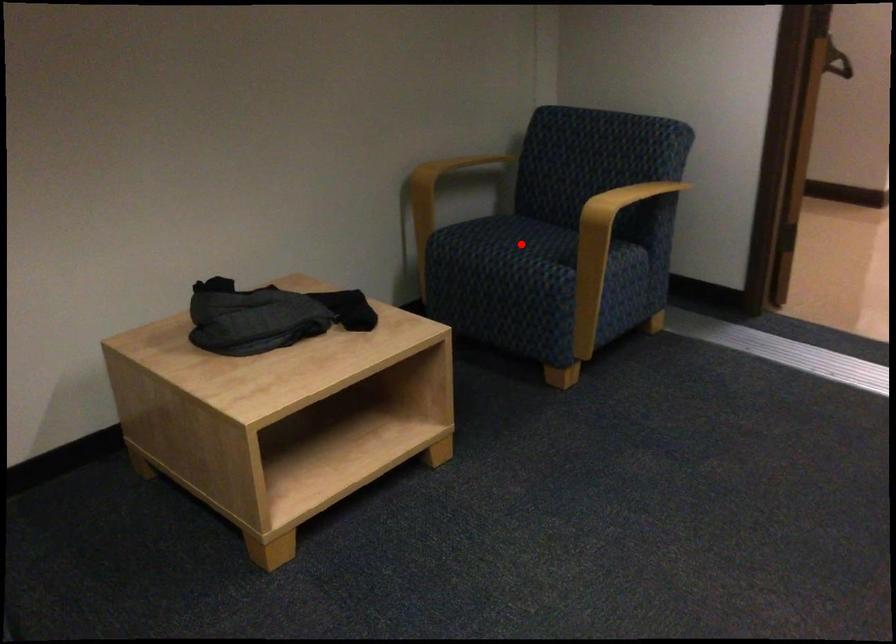
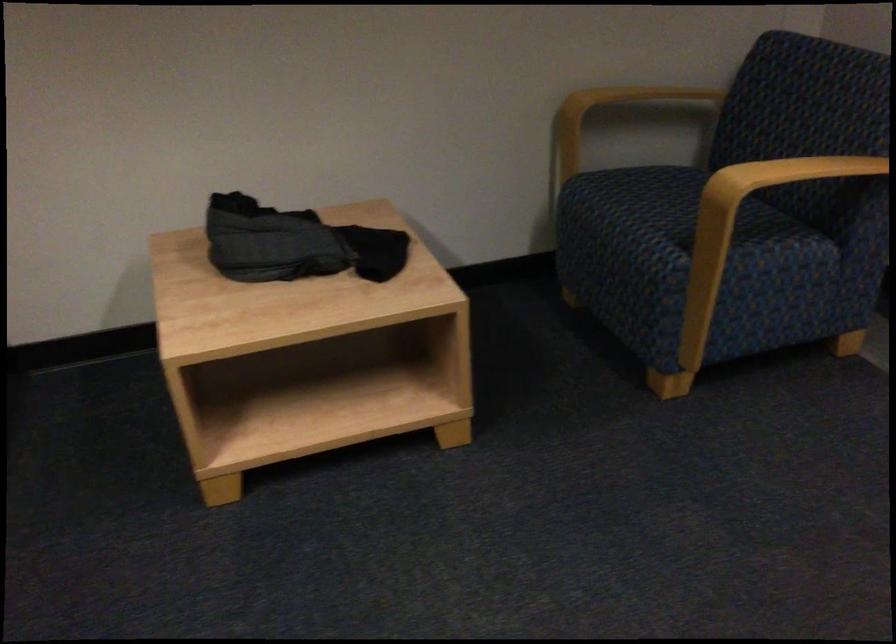
Question: I am providing you with two images of the same scene from different viewpoints. Given a red point in image1, look at the same physical point in image2. Is it:

Choices:
 (A) Closer to the viewpoint
 (B) Farther from the viewpoint

Answer: (A)